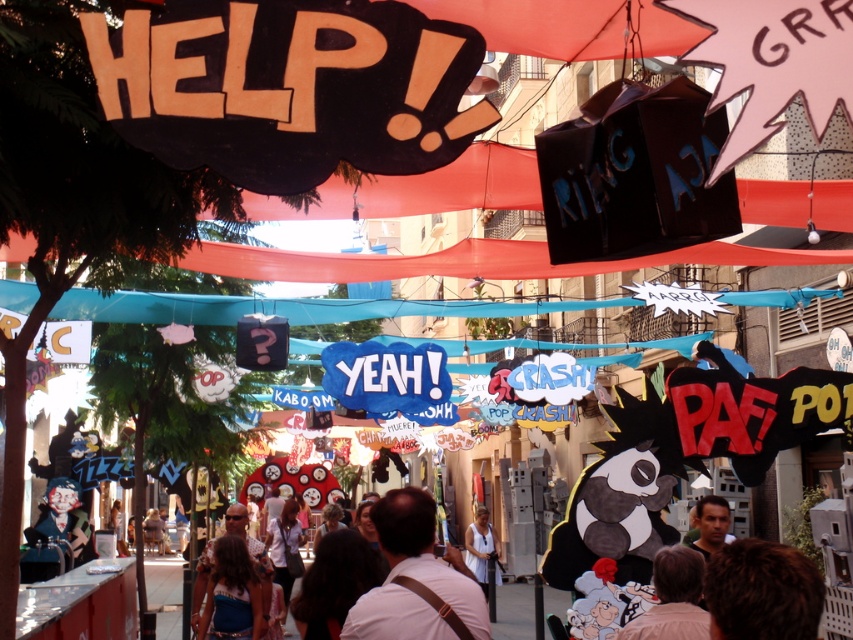
Which is behind, point (485, 540) or point (705, 545)?

The point (485, 540) is behind.

In order to click on white fabric dress at center in this screenshot , I will do `click(480, 547)`.

Is matte clown mask at lower left closer to camera compared to white fabric dress at center?

Yes, it is in front of white fabric dress at center.

Between matte clown mask at lower left and white fabric dress at center, which one is positioned higher?

Positioned higher is matte clown mask at lower left.

Between point (44, 548) and point (494, 557), which one is positioned in front?

Positioned in front is point (44, 548).

Where is `matte clown mask at lower left`? Image resolution: width=853 pixels, height=640 pixels. matte clown mask at lower left is located at coordinates (56, 531).

Who is positioned more to the left, light brown hair at center or smooth skin face at center?

light brown hair at center

Is light brown hair at center smaller than smooth skin face at center?

Incorrect, light brown hair at center is not smaller in size than smooth skin face at center.

Which is in front, point (683, 554) or point (718, 525)?

Point (683, 554)

Find the location of a particular element. light brown hair at center is located at coordinates (672, 598).